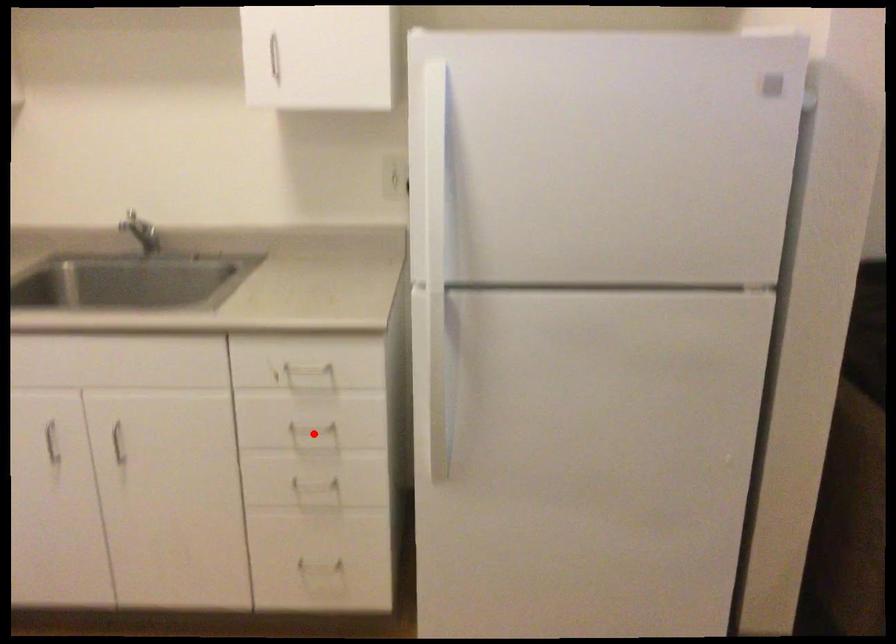
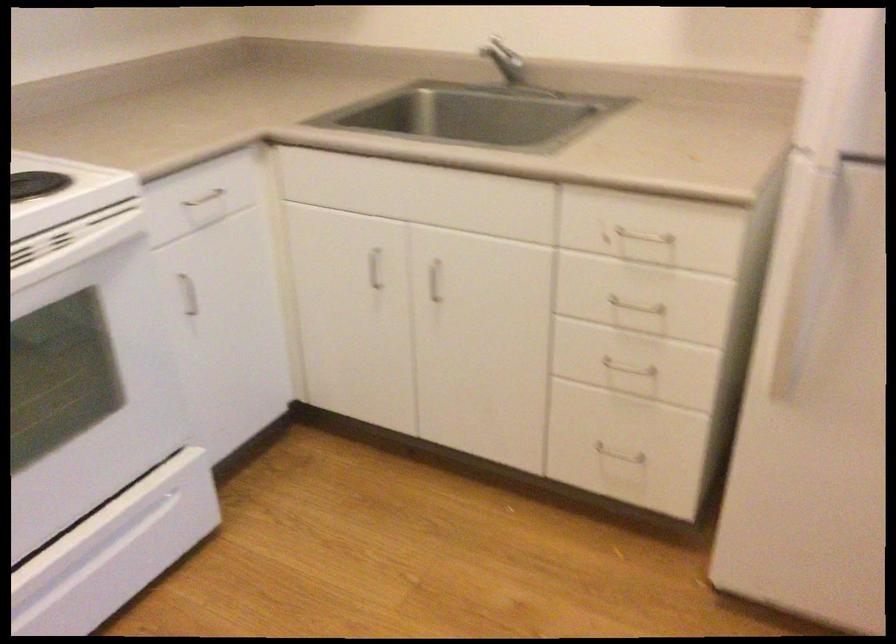
The point at the highlighted location is marked in the first image. Where is the corresponding point in the second image?

(634, 313)